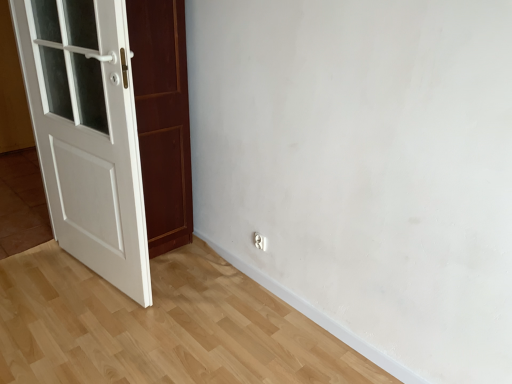
Question: Is white wooden door at left in front of white glossy electric outlet at lower center?

Choices:
 (A) yes
 (B) no

Answer: (A)

Question: From the image's perspective, is white wooden door at left below white glossy electric outlet at lower center?

Choices:
 (A) no
 (B) yes

Answer: (A)

Question: Is white wooden door at left far away from white glossy electric outlet at lower center?

Choices:
 (A) yes
 (B) no

Answer: (A)

Question: From a real-world perspective, is white wooden door at left positioned under white glossy electric outlet at lower center based on gravity?

Choices:
 (A) yes
 (B) no

Answer: (B)

Question: Can you confirm if white wooden door at left is bigger than white glossy electric outlet at lower center?

Choices:
 (A) no
 (B) yes

Answer: (B)

Question: Does white wooden door at left come behind white glossy electric outlet at lower center?

Choices:
 (A) yes
 (B) no

Answer: (B)

Question: Is white glossy electric outlet at lower center placed right next to white wooden door at left?

Choices:
 (A) no
 (B) yes

Answer: (A)

Question: Does white glossy electric outlet at lower center have a larger size compared to white wooden door at left?

Choices:
 (A) yes
 (B) no

Answer: (B)

Question: Is white glossy electric outlet at lower center positioned in front of white wooden door at left?

Choices:
 (A) yes
 (B) no

Answer: (B)

Question: Does white glossy electric outlet at lower center have a lesser width compared to white wooden door at left?

Choices:
 (A) no
 (B) yes

Answer: (B)

Question: From a real-world perspective, is white glossy electric outlet at lower center physically above white wooden door at left?

Choices:
 (A) no
 (B) yes

Answer: (A)

Question: Would you say white glossy electric outlet at lower center is a long distance from white wooden door at left?

Choices:
 (A) yes
 (B) no

Answer: (A)

Question: Considering the positions of white glossy electric outlet at lower center and white wooden door at left in the image, is white glossy electric outlet at lower center bigger or smaller than white wooden door at left?

Choices:
 (A) small
 (B) big

Answer: (A)